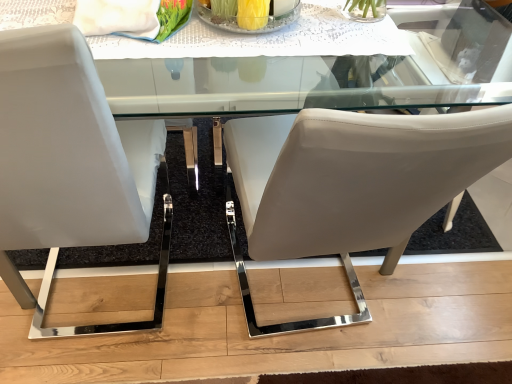
Locate an element on the screen. Image resolution: width=512 pixels, height=384 pixels. vacant area on top of clear glass table at upper center (from a real-world perspective) is located at coordinates (227, 24).